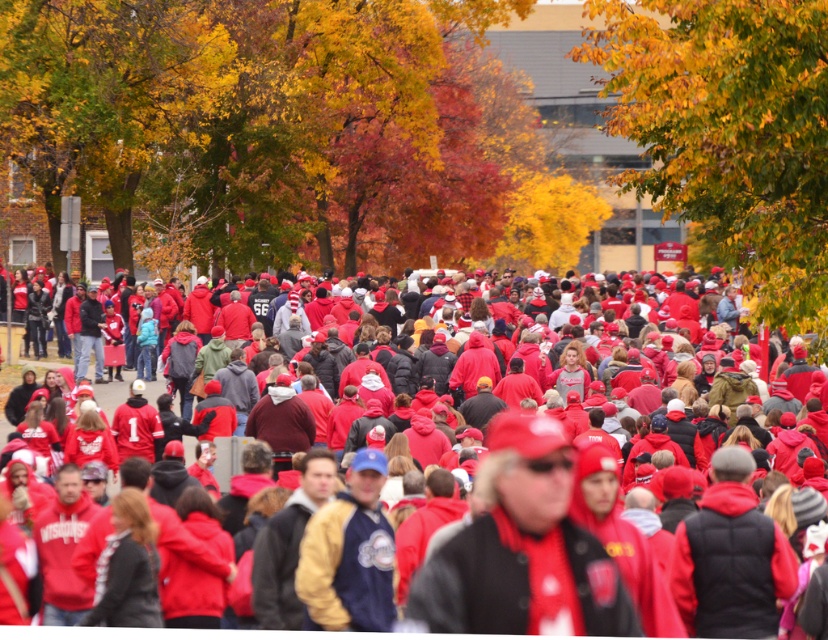
Question: Does matte red cap at center have a greater width compared to matte red jackets at center?

Choices:
 (A) yes
 (B) no

Answer: (B)

Question: Does matte red cap at center appear over matte red jackets at center?

Choices:
 (A) no
 (B) yes

Answer: (A)

Question: Is matte red cap at center smaller than matte red jackets at center?

Choices:
 (A) no
 (B) yes

Answer: (B)

Question: Which point is farther from the camera taking this photo?

Choices:
 (A) (542, 518)
 (B) (123, 384)

Answer: (B)